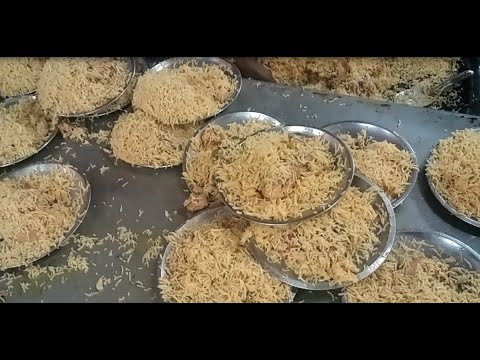
Find the location of `spatula handle`. spatula handle is located at coordinates (456, 73).